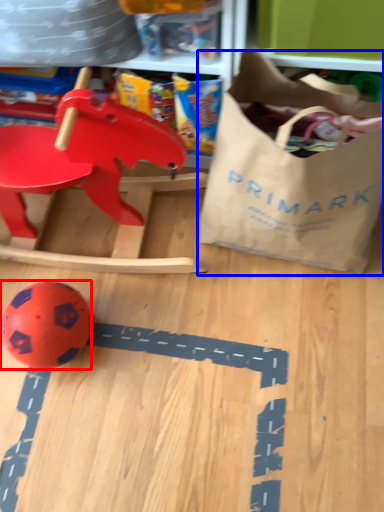
Question: Which object appears closest to the camera in this image, toy (highlighted by a red box) or grocery bag (highlighted by a blue box)?

Choices:
 (A) toy
 (B) grocery bag

Answer: (B)